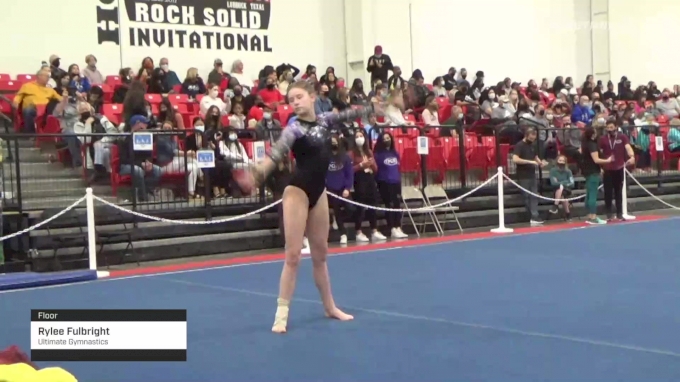
This screenshot has width=680, height=382. I want to click on floor, so click(515, 283).